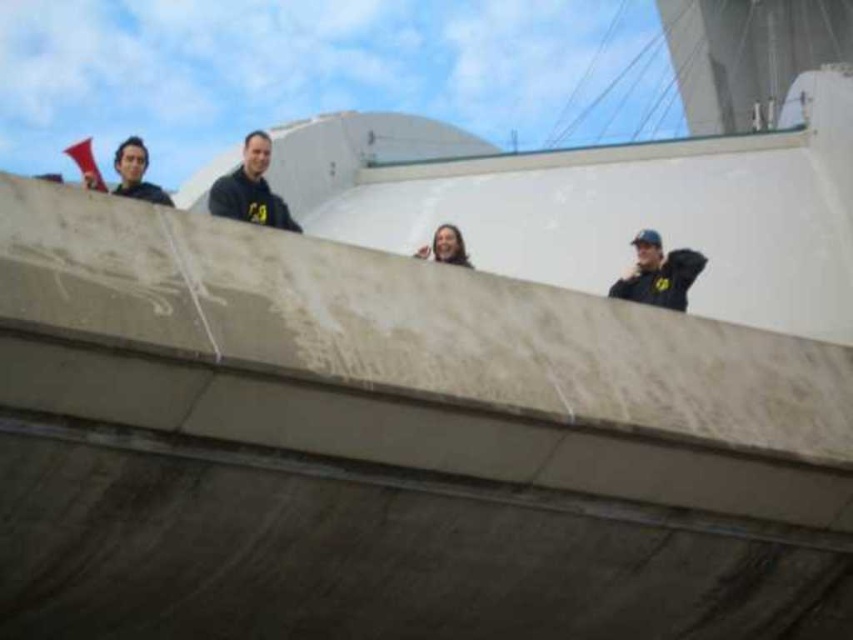
Measure the distance between black matte jacket at center and smooth skin face at center.

A distance of 5.50 meters exists between black matte jacket at center and smooth skin face at center.

Between point (270, 204) and point (444, 250), which one is positioned in front?

Point (270, 204) is in front.

Identify the location of black matte jacket at center. This screenshot has height=640, width=853. (250, 189).

Consider the image. How far apart are matte black shirt at upper left and smooth skin face at center?

matte black shirt at upper left and smooth skin face at center are 28.14 feet apart from each other.

Who is taller, matte black shirt at upper left or smooth skin face at center?

matte black shirt at upper left is taller.

Does point (160, 198) come farther from viewer compared to point (434, 248)?

No, (160, 198) is in front of (434, 248).

Locate an element on the screen. This screenshot has height=640, width=853. matte black shirt at upper left is located at coordinates (136, 173).

In the scene shown: Who is higher up, black matte jacket at center or black matte jacket at upper right?

black matte jacket at center

Which is more to the right, black matte jacket at center or black matte jacket at upper right?

From the viewer's perspective, black matte jacket at upper right appears more on the right side.

Is point (263, 179) farther from viewer compared to point (647, 236)?

No, (263, 179) is closer to viewer.

Where is `black matte jacket at center`? The height and width of the screenshot is (640, 853). black matte jacket at center is located at coordinates (250, 189).